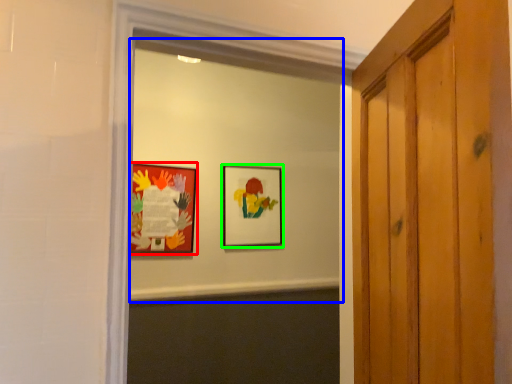
Question: Which is nearer to the picture frame (highlighted by a red box)? mirror (highlighted by a blue box) or picture frame (highlighted by a green box).

Choices:
 (A) mirror
 (B) picture frame

Answer: (A)